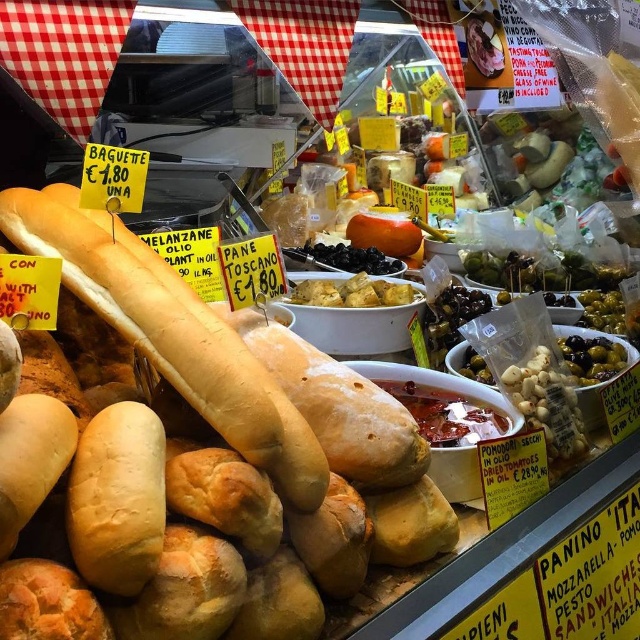
You are a customer at the market stall and want to buy the golden brown crusty baguette at center and the golden brown croutons at center. The baguette is priced at 1.80 euros and the croutons are priced at 1.80 euros. If you have a 5 euro bill, will you have enough money to buy both items?

The golden brown crusty baguette at center costs 1.80 euros and the golden brown croutons at center costs 1.80 euros. Adding both together, the total would be 3.60 euros. Since you have a 5 euro bill, you have enough money to purchase both items.

Consider the image. You are a customer at the market stall and want to buy the golden brown crusty baguette at center. The stall has a counter that is 1 meter wide. If you stand directly in front of the baguette, how far to the left or right would you need to move to reach the edge of the counter?

The golden brown crusty baguette at center is positioned at point 0.520 on the horizontal axis. Since the counter is 1 meter wide, the center is at 0.5 meters. The baguette is slightly to the right of center, so moving to the right from its position would bring you closer to the right edge of the counter.